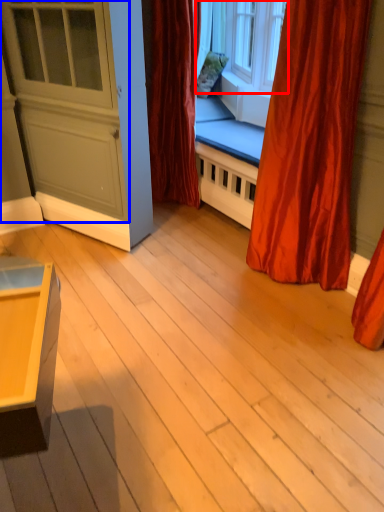
Question: Which point is further to the camera, window (highlighted by a red box) or screen door (highlighted by a blue box)?

Choices:
 (A) window
 (B) screen door

Answer: (A)